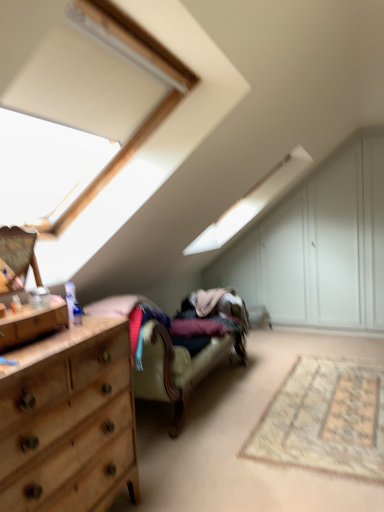
Identify the location of empty space that is ontop of wooden dresser at left (from a real-world perspective). (28, 307).